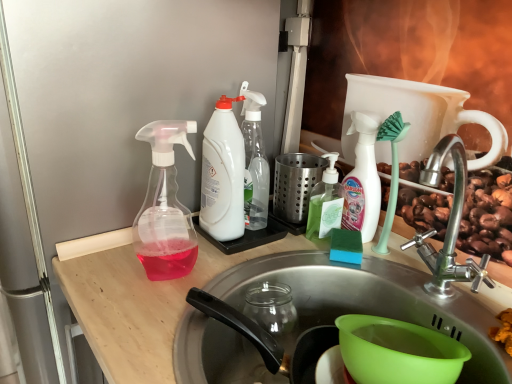
I want to click on vacant position to the left of transparent plastic spray bottle at left, the first bottle when ordered from left to right, so [x=105, y=269].